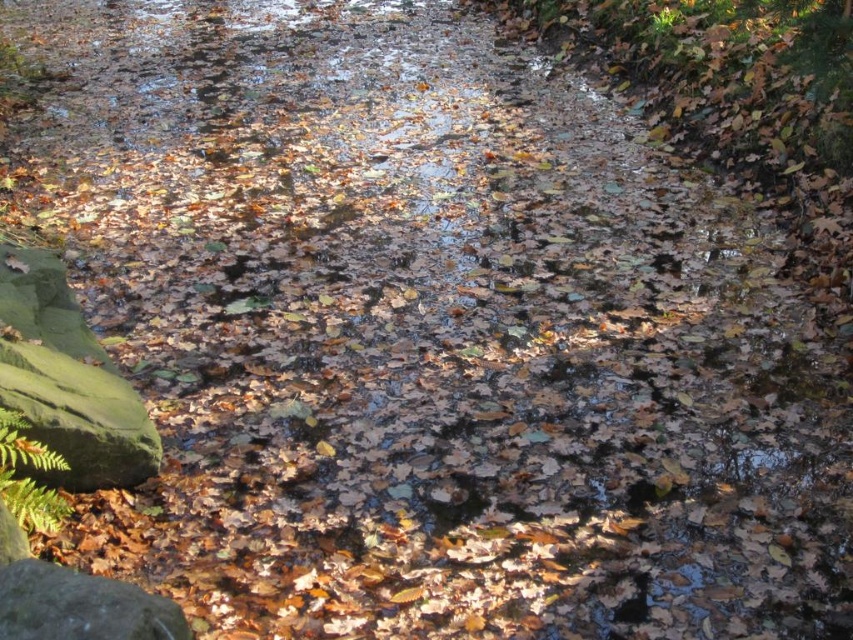
Can you confirm if green mossy rock at lower left is thinner than matte gray rock at lower left?

Incorrect, green mossy rock at lower left's width is not less than matte gray rock at lower left's.

Measure the distance between green mossy rock at lower left and camera.

green mossy rock at lower left is 8.99 feet from camera.

Find the location of a particular element. This screenshot has height=640, width=853. green mossy rock at lower left is located at coordinates (67, 380).